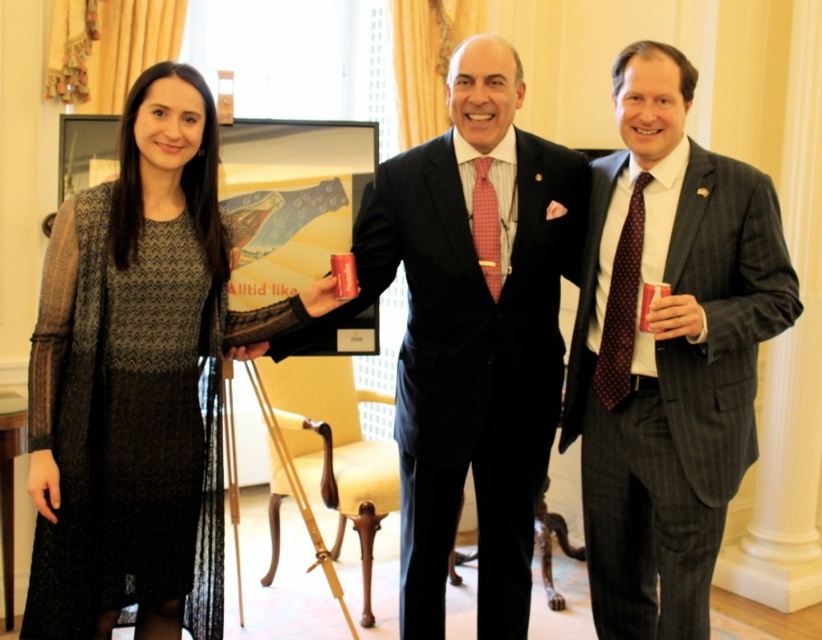
Question: Can you confirm if polka dot silk tie at right is positioned below red woven tie at center?

Choices:
 (A) no
 (B) yes

Answer: (B)

Question: Which is farther from the red woven tie at center?

Choices:
 (A) dark gray pinstripe suit at right
 (B) matte black suit at center
 (C) knitted wool dress at left

Answer: (C)

Question: Is knitted wool dress at left wider than matte black suit at center?

Choices:
 (A) yes
 (B) no

Answer: (B)

Question: Can you confirm if knitted wool dress at left is bigger than dark gray pinstripe suit at right?

Choices:
 (A) no
 (B) yes

Answer: (A)

Question: Which object is positioned closest to the matte black suit at center?

Choices:
 (A) polka dot silk tie at right
 (B) red woven tie at center

Answer: (B)

Question: Which object is closer to the camera taking this photo?

Choices:
 (A) matte black suit at center
 (B) knitted wool dress at left

Answer: (B)